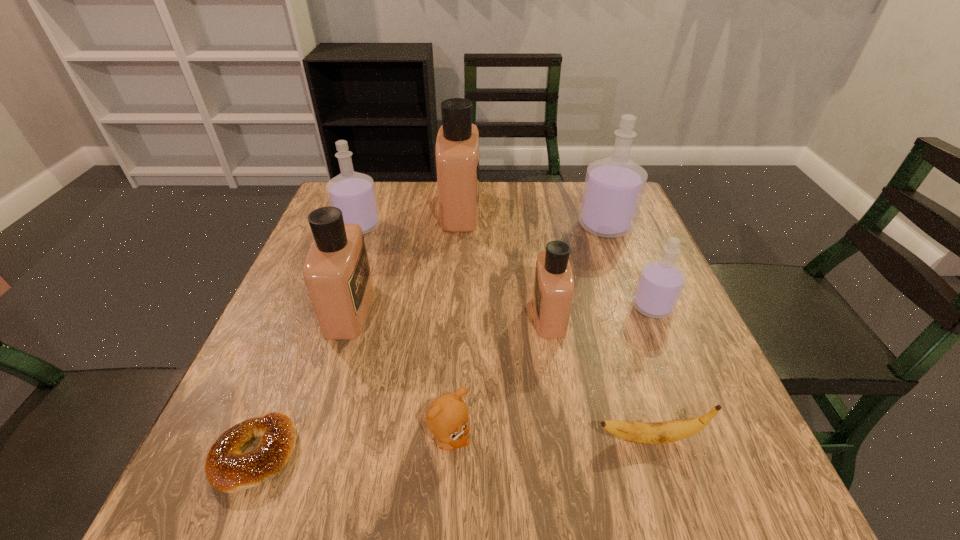
Locate which beige perfume ranks third in proximity to the biggest purple perfume. Please provide its 2D coordinates. Your answer should be formatted as a tuple, i.e. [(x, y)], where the tuple contains the x and y coordinates of a point satisfying the conditions above.

[(336, 271)]

Locate an element on the screen. beige perfume object that ranks as the third closest to the nearest purple perfume is located at coordinates (336, 271).

Locate which purple perfume ranks second in proximity to the second biggest purple perfume. Please provide its 2D coordinates. Your answer should be formatted as a tuple, i.e. [(x, y)], where the tuple contains the x and y coordinates of a point satisfying the conditions above.

[(660, 283)]

Choose which purple perfume is the second nearest neighbor to the biggest purple perfume. Please provide its 2D coordinates. Your answer should be formatted as a tuple, i.e. [(x, y)], where the tuple contains the x and y coordinates of a point satisfying the conditions above.

[(353, 193)]

The image size is (960, 540). I want to click on vacant region that satisfies the following two spatial constraints: 1. on the face of the brown teddy bear; 2. on the front side of the tan bagel, so click(x=448, y=454).

Locate an element on the screen. vacant point that satisfies the following two spatial constraints: 1. on the front label of the fourth object from right to left; 2. on the front side of the tan bagel is located at coordinates (571, 454).